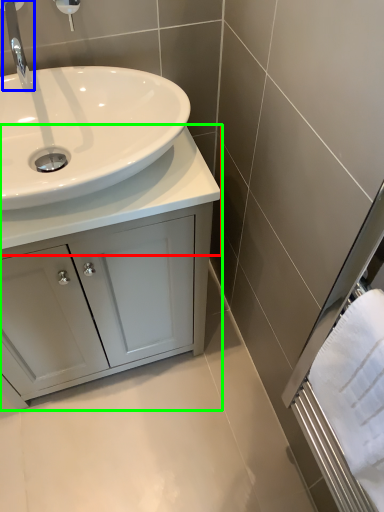
Question: Considering the real-world distances, which object is farthest from counter top (highlighted by a red box)? tap (highlighted by a blue box) or bathroom cabinet (highlighted by a green box)?

Choices:
 (A) tap
 (B) bathroom cabinet

Answer: (A)